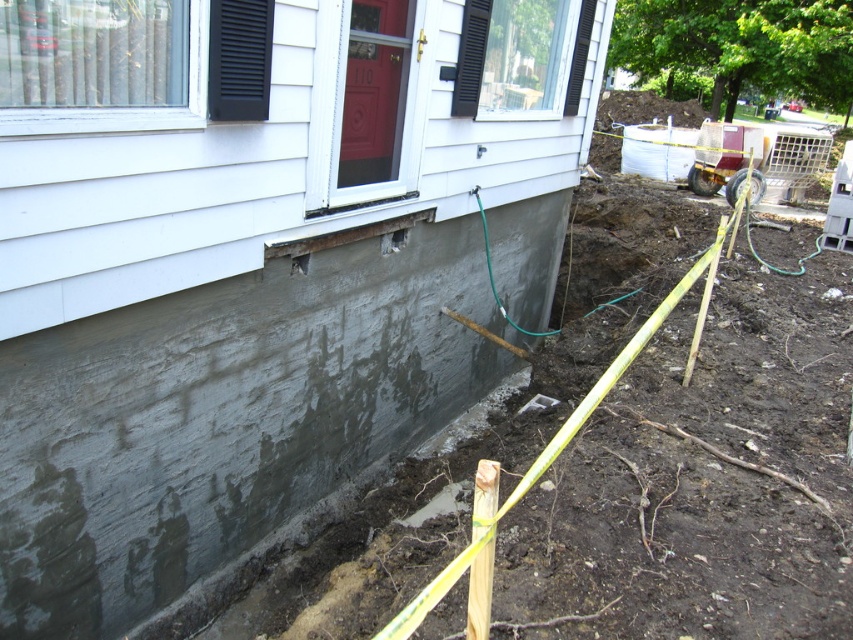
Does point (206, 476) come farther from viewer compared to point (300, 273)?

No.

Does gray concrete foundation at lower left lie behind rusty metal hole at lower center?

No.

Which is in front, point (144, 403) or point (289, 257)?

Point (144, 403)

Where is `gray concrete foundation at lower left`? The height and width of the screenshot is (640, 853). gray concrete foundation at lower left is located at coordinates (222, 417).